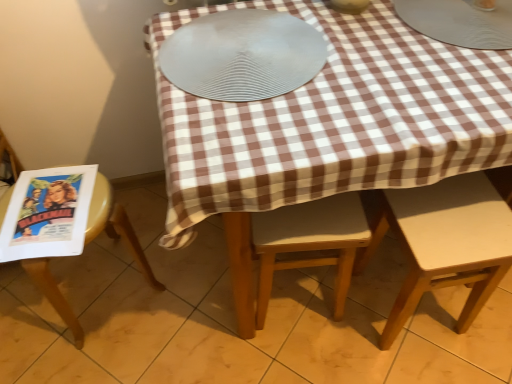
Where is `free space between yellow plastic chair at left, acting as the first chair starting from the left, and light brown wooden chair at center, placed as the second chair when sorted from left to right`? free space between yellow plastic chair at left, acting as the first chair starting from the left, and light brown wooden chair at center, placed as the second chair when sorted from left to right is located at coordinates (183, 299).